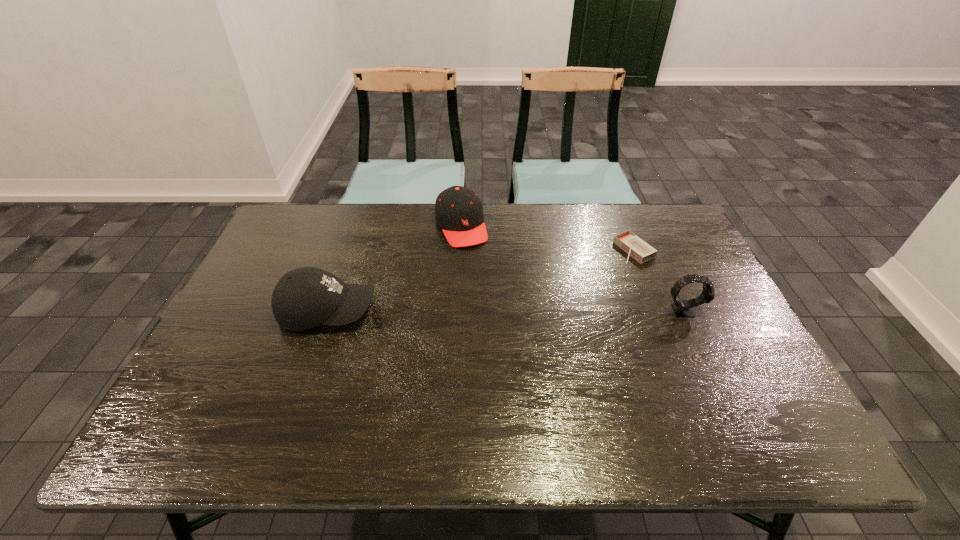
Locate an element on the screen. This screenshot has width=960, height=540. vacant space in between the cap and the watch is located at coordinates (572, 268).

This screenshot has height=540, width=960. What are the coordinates of `free point between the watch and the baseball cap` in the screenshot? It's located at (506, 310).

Locate an element on the screen. Image resolution: width=960 pixels, height=540 pixels. vacant region between the watch and the cap is located at coordinates (572, 268).

You are a GUI agent. You are given a task and a screenshot of the screen. Output one action in this format:
    pyautogui.click(x=<x>, y=<y>)
    Task: Click on the object that is the third closest to the shortest object
    The width and height of the screenshot is (960, 540).
    Given the screenshot: What is the action you would take?
    pyautogui.click(x=303, y=298)

Identify which object is the third nearest to the shortest object. Please provide its 2D coordinates. Your answer should be formatted as a tuple, i.e. [(x, y)], where the tuple contains the x and y coordinates of a point satisfying the conditions above.

[(303, 298)]

In order to click on blank area in the image that satisfies the following two spatial constraints: 1. on the front side of the watch; 2. on the face of the matchbox in this screenshot , I will do `click(658, 310)`.